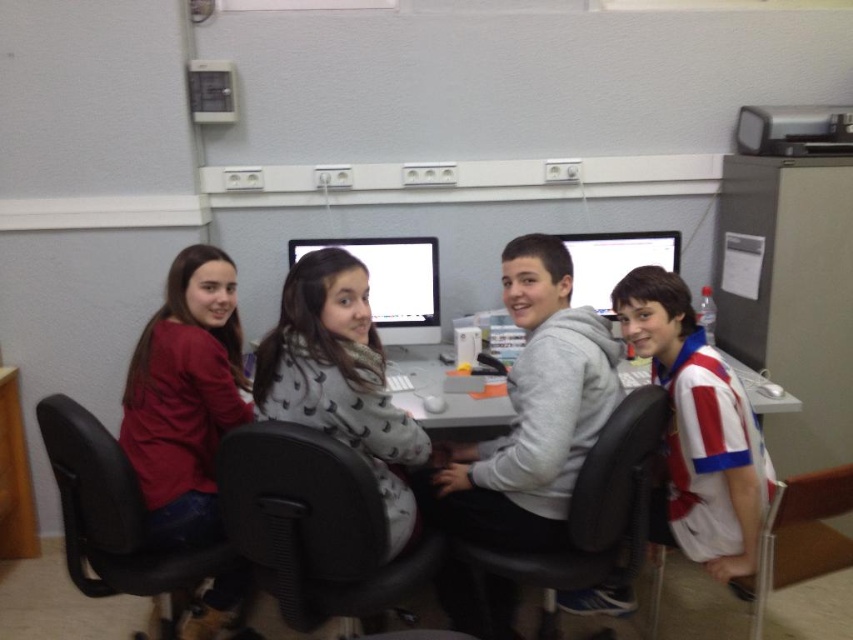
You are standing in the classroom and want to reach both the point at coordinates (155,481) and the point at coordinates (614,246). Which point should you approach first to reach the closer one?

You should approach point (155,481) first because it is closer to you than point (614,246).

You are standing at the entrance of the classroom and see the matte red shirt at left and the white plastic table at center. Which object is nearer to you?

The matte red shirt at left is closer to the viewer than the white plastic table at center.